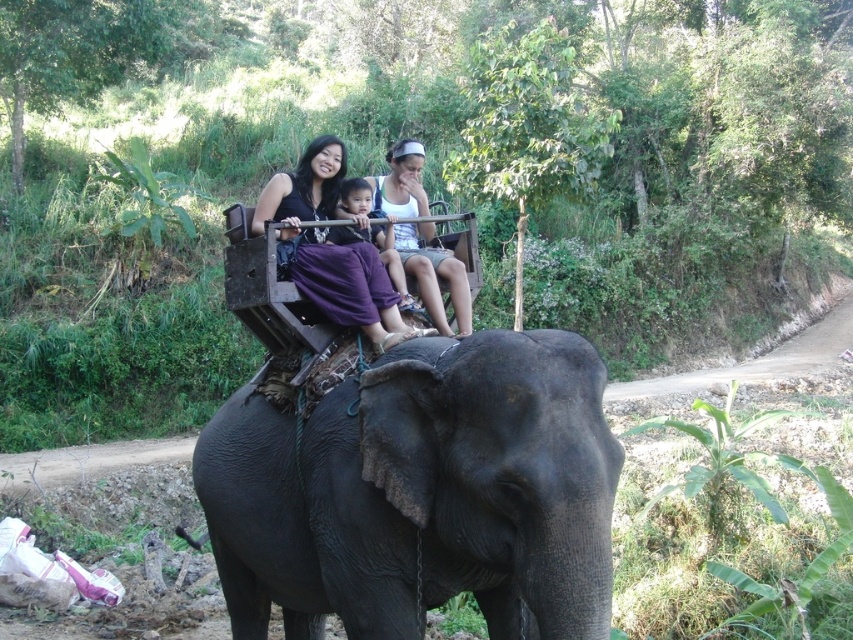
How much distance is there between dark gray textured elephant at center and matte purple skirt at center?

37.73 inches

Is dark gray textured elephant at center smaller than matte purple skirt at center?

Incorrect, dark gray textured elephant at center is not smaller in size than matte purple skirt at center.

Find the location of `dark gray textured elephant at center`. dark gray textured elephant at center is located at coordinates (421, 493).

What do you see at coordinates (421, 493) in the screenshot? I see `dark gray textured elephant at center` at bounding box center [421, 493].

Is point (527, 582) positioned in front of point (426, 305)?

Yes, point (527, 582) is closer to viewer.

This screenshot has width=853, height=640. What are the coordinates of `dark gray textured elephant at center` in the screenshot? It's located at (421, 493).

This screenshot has width=853, height=640. Find the location of `dark gray textured elephant at center`. dark gray textured elephant at center is located at coordinates (421, 493).

The image size is (853, 640). I want to click on matte purple skirt at center, so click(331, 248).

Is point (344, 294) behind point (422, 164)?

No, it is not.

The height and width of the screenshot is (640, 853). What are the coordinates of `matte purple skirt at center` in the screenshot? It's located at (331, 248).